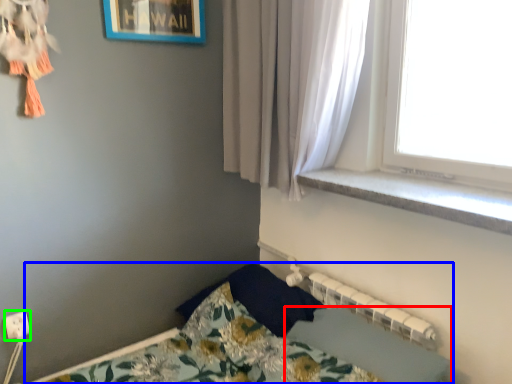
Question: Estimate the real-world distances between objects in this image. Which object is farther from sheet (highlighted by a red box), bed (highlighted by a blue box) or electric outlet (highlighted by a green box)?

Choices:
 (A) bed
 (B) electric outlet

Answer: (B)